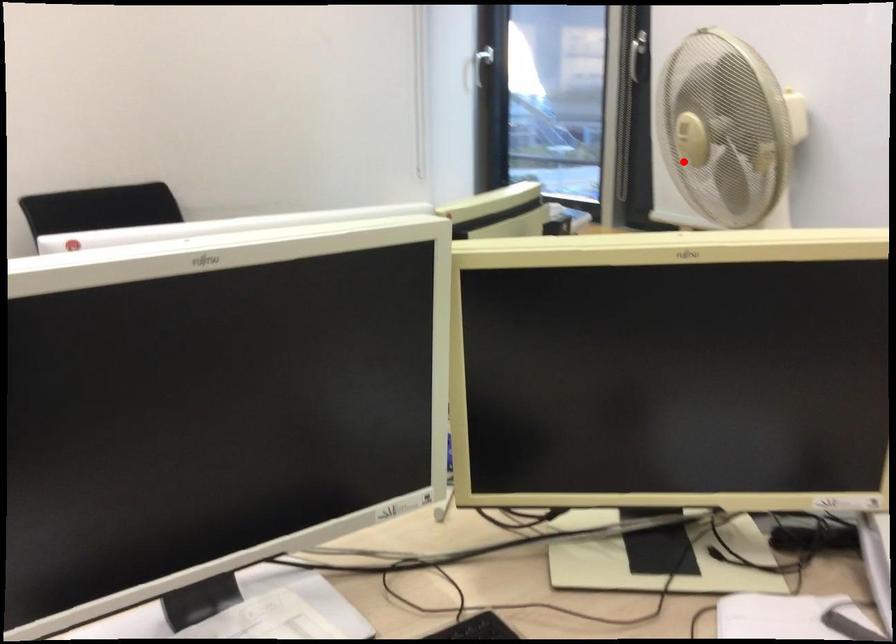
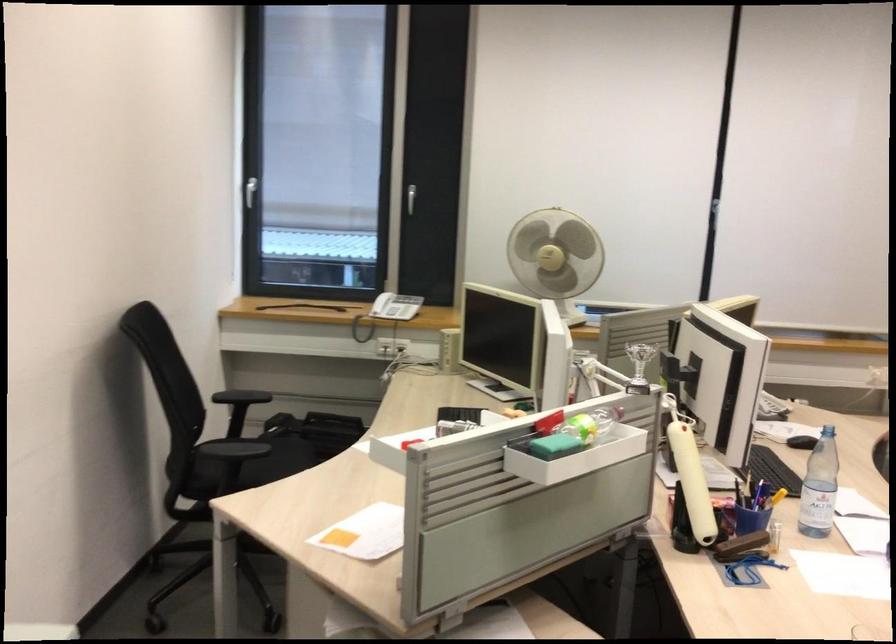
In the second image, find the point that corresponds to the highlighted location in the first image.

(556, 257)